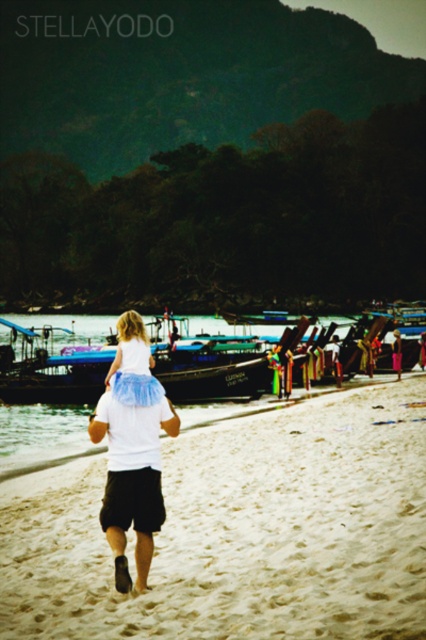
Is wooden boat at center taller than white matte shirt at center?

Indeed, wooden boat at center has a greater height compared to white matte shirt at center.

Between point (310, 362) and point (143, 346), which one is positioned in front?

Point (143, 346)

Identify the location of wooden boat at center. This screenshot has height=640, width=426. (235, 358).

Who is more forward, (109, 540) or (131, 380)?

Point (131, 380) is more forward.

Is white matte shirt at center thinner than white tulle skirt at center?

No, white matte shirt at center is not thinner than white tulle skirt at center.

Between point (152, 438) and point (120, 360), which one is positioned behind?

The point (120, 360) is behind.

Identify the location of white matte shirt at center. (132, 449).

Does wooden boat at center come in front of white tulle skirt at center?

No, it is not.

Which is more to the right, wooden boat at center or white tulle skirt at center?

Positioned to the right is white tulle skirt at center.

Who is more forward, [327,337] or [118,355]?

Point [118,355] is more forward.

This screenshot has width=426, height=640. I want to click on wooden boat at center, so click(235, 358).